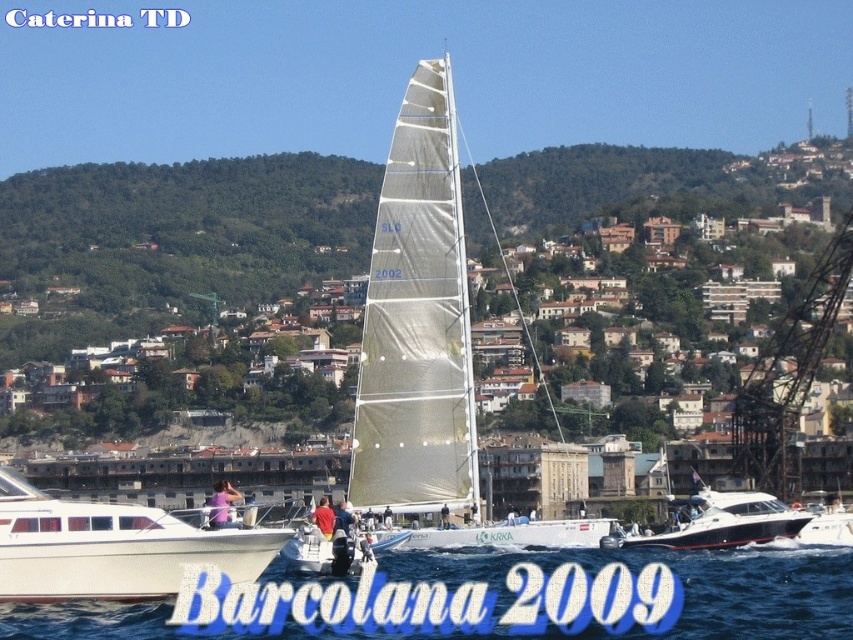
Question: Is white glossy boat at lower left bigger than pink fabric person at center?

Choices:
 (A) no
 (B) yes

Answer: (A)

Question: Is pink fabric person at center to the left of white fabric sail at center from the viewer's perspective?

Choices:
 (A) yes
 (B) no

Answer: (A)

Question: Which point is farther to the camera?

Choices:
 (A) [x=136, y=550]
 (B) [x=387, y=518]

Answer: (B)

Question: Among these points, which one is nearest to the camera?

Choices:
 (A) (440, 524)
 (B) (384, 525)
 (C) (213, 506)
 (D) (380, 330)

Answer: (C)

Question: Which of these objects is positioned farthest from the red fabric shirt at center?

Choices:
 (A) blue fabric shirt at center
 (B) blue water at lower center
 (C) transparent white sail at center

Answer: (B)

Question: Is pink fabric person at center above white fabric sail at center?

Choices:
 (A) yes
 (B) no

Answer: (B)